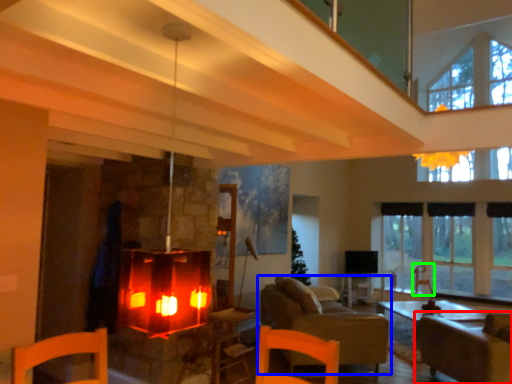
Question: Estimate the real-world distances between objects in this image. Which object is farther from armchair (highlighted by a red box), studio couch (highlighted by a blue box) or armchair (highlighted by a green box)?

Choices:
 (A) studio couch
 (B) armchair

Answer: (B)